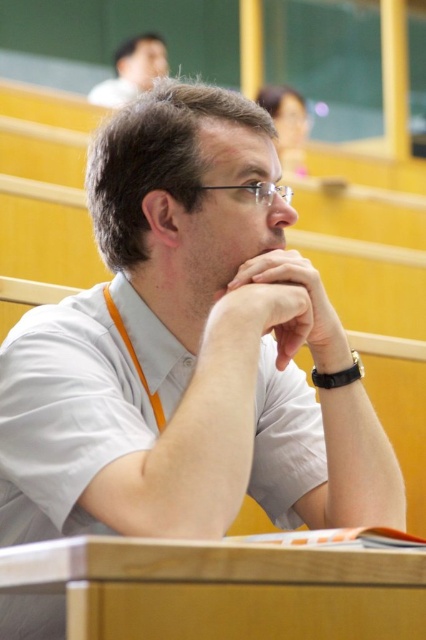
You are organizing a photo shoot and need to ensure that the matte skin hand at center and the matte white shirt at upper center are both visible in the frame. Given their sizes, which object should you prioritize focusing on to ensure clarity?

The matte skin hand at center is smaller than the matte white shirt at upper center, so you should prioritize focusing on the matte skin hand at center to ensure its details are clear in the photo.

You are a photographer standing at the back of the lecture hall. You want to take a photo of the speaker, but you need to ensure that both the matte skin hand at center and the matte white shirt at upper center are in focus. Given that your camera has a depth of field that can cover 3 meters, will both objects be in focus?

The distance between the matte skin hand at center and the matte white shirt at upper center is 3.81 meters. Since the camera can only cover 3 meters, the depth of field is insufficient to keep both objects in focus simultaneously.